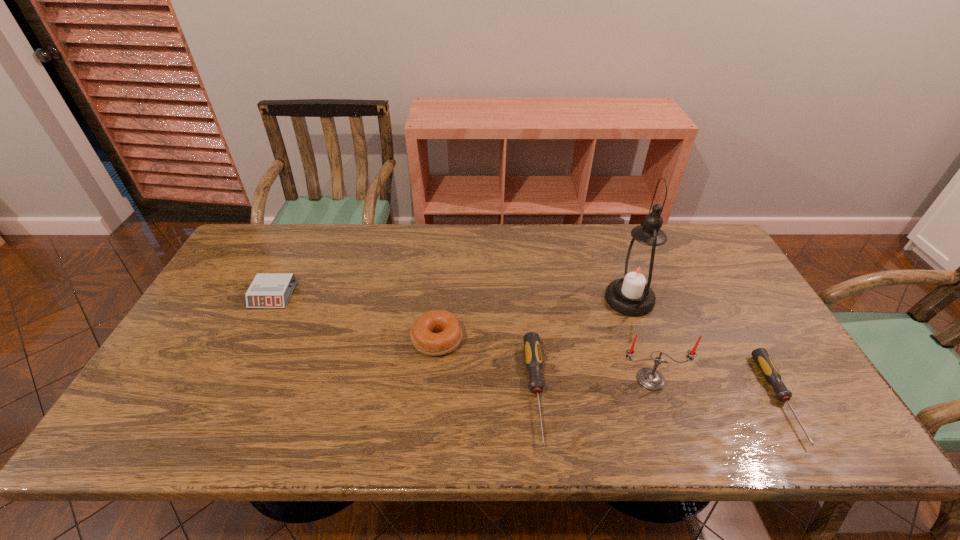
Where is `the taller screwdriver`? The height and width of the screenshot is (540, 960). the taller screwdriver is located at coordinates (533, 357).

This screenshot has width=960, height=540. In order to click on the third object from left to right in this screenshot , I will do `click(533, 357)`.

Where is `the shortest object`? The width and height of the screenshot is (960, 540). the shortest object is located at coordinates (770, 372).

The height and width of the screenshot is (540, 960). I want to click on the shorter screwdriver, so click(x=770, y=372).

The height and width of the screenshot is (540, 960). In order to click on the tallest object in this screenshot , I will do `click(638, 270)`.

This screenshot has width=960, height=540. I want to click on alarm clock, so click(x=268, y=290).

At what (x,y) coordinates should I click in order to perform the action: click on the second object from left to right. Please return your answer as a coordinate pair (x, y). This screenshot has height=540, width=960. Looking at the image, I should click on (437, 332).

The width and height of the screenshot is (960, 540). Find the location of `bagel`. bagel is located at coordinates (437, 332).

Where is `the fifth shortest object`? The width and height of the screenshot is (960, 540). the fifth shortest object is located at coordinates (650, 378).

You are a GUI agent. You are given a task and a screenshot of the screen. Output one action in this format:
    pyautogui.click(x=<x>, y=<y>)
    Task: Click on the vacant position located 0.090m on the right of the tallest object
    
    Given the screenshot: What is the action you would take?
    pyautogui.click(x=684, y=299)